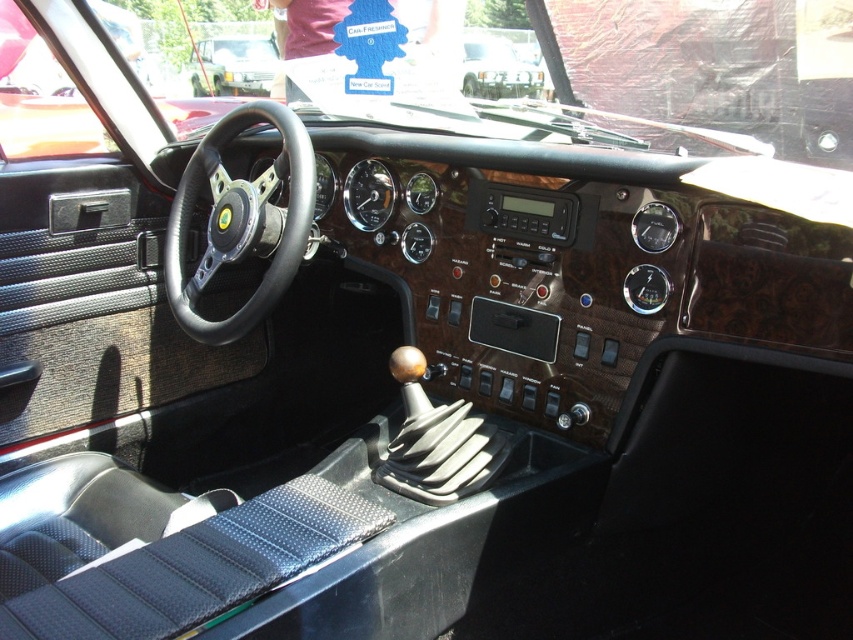
Question: Is black leather steering wheel at center smaller than metallic silver car at upper center?

Choices:
 (A) yes
 (B) no

Answer: (B)

Question: Can you confirm if matte black steering wheel at center is thinner than metallic silver car at upper center?

Choices:
 (A) no
 (B) yes

Answer: (A)

Question: Estimate the real-world distances between objects in this image. Which object is closer to the black leather steering wheel at center?

Choices:
 (A) matte black steering wheel at center
 (B) metallic silver car at upper center

Answer: (B)

Question: Which point is closer to the camera?

Choices:
 (A) (469, 54)
 (B) (192, 68)

Answer: (A)

Question: Observing the image, what is the correct spatial positioning of black leather steering wheel at center in reference to metallic silver car at upper center?

Choices:
 (A) right
 (B) left

Answer: (B)

Question: Considering the real-world distances, which object is closest to the metallic silver car at upper center?

Choices:
 (A) black leather steering wheel at center
 (B) matte black steering wheel at center

Answer: (A)